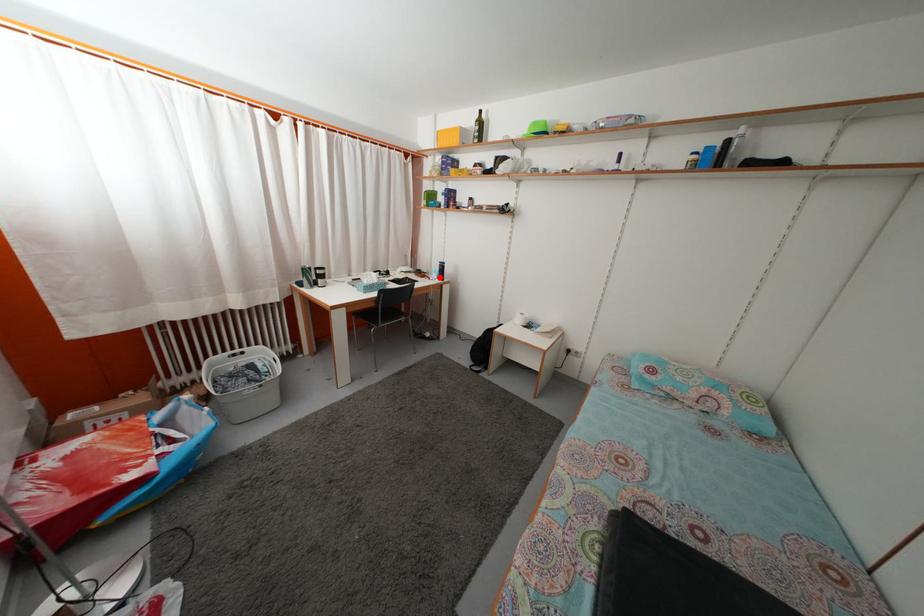
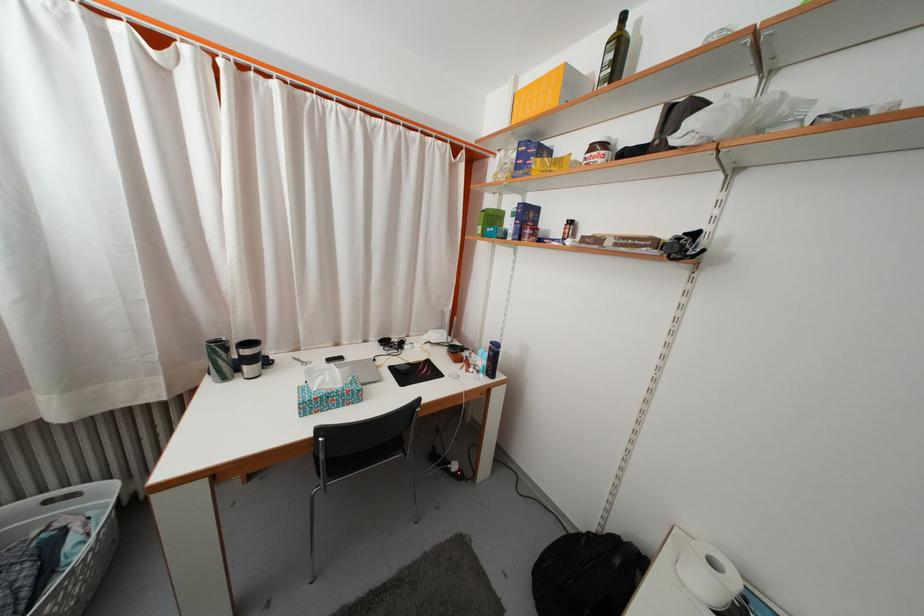
In the second image, find the point that corresponds to the highlighted location in the first image.

(485, 359)